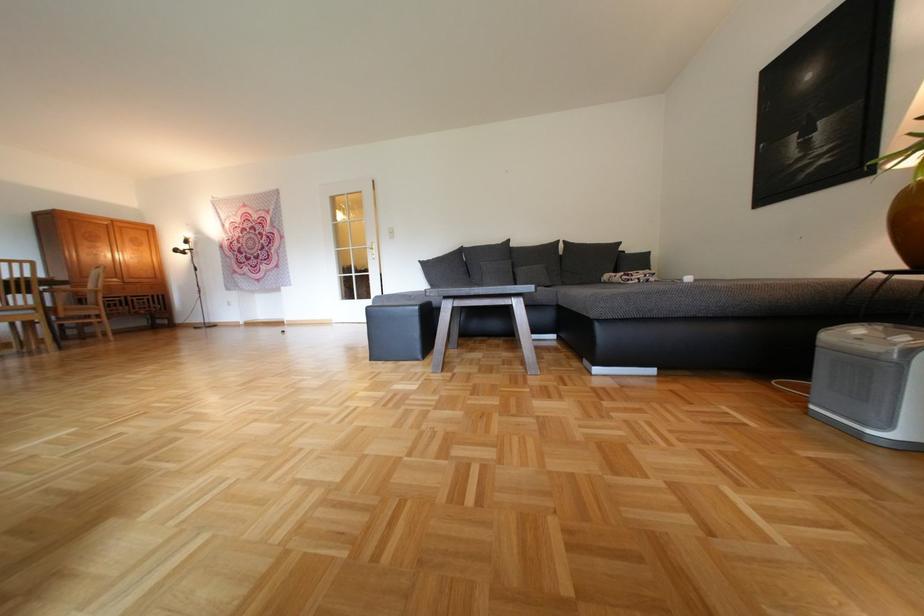
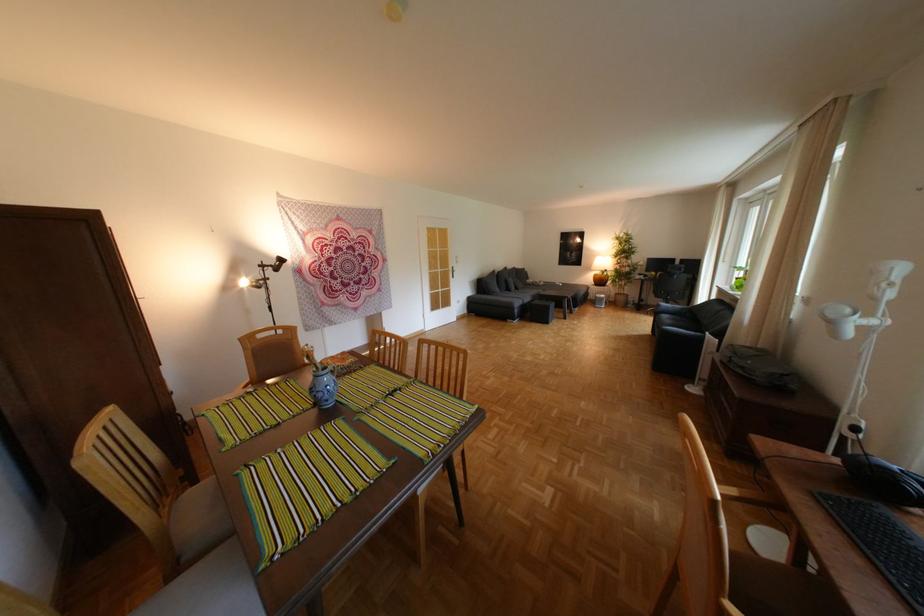
Find the pixel in the second image that matches (363,248) in the first image.

(453, 270)